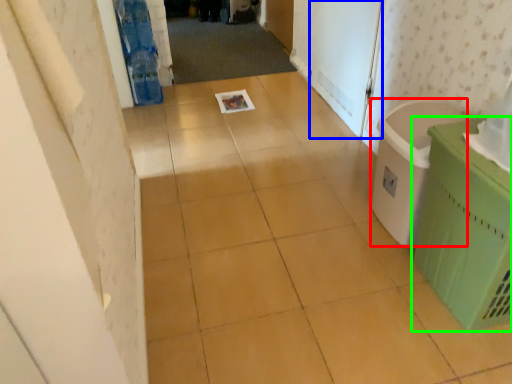
Question: Which is nearer to the laundry basket (highlighted by a red box)? screen door (highlighted by a blue box) or waste container (highlighted by a green box).

Choices:
 (A) screen door
 (B) waste container

Answer: (B)